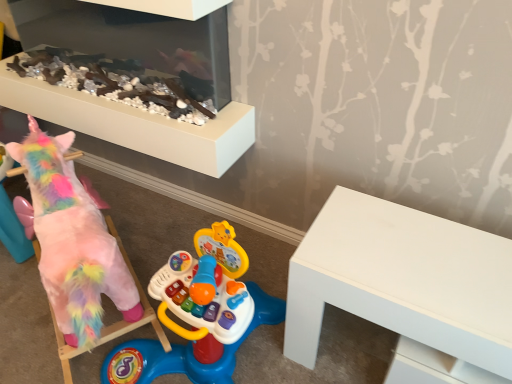
This screenshot has width=512, height=384. I want to click on vacant area situated below smooth white fireplace at upper center (from a real-world perspective), so click(x=147, y=203).